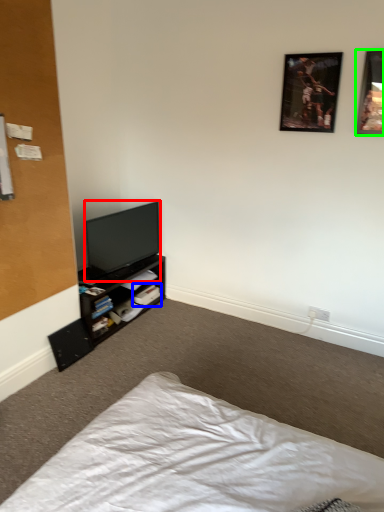
Question: Estimate the real-world distances between objects in this image. Which object is closer to television (highlighted by a red box), book (highlighted by a blue box) or picture frame (highlighted by a green box)?

Choices:
 (A) book
 (B) picture frame

Answer: (A)